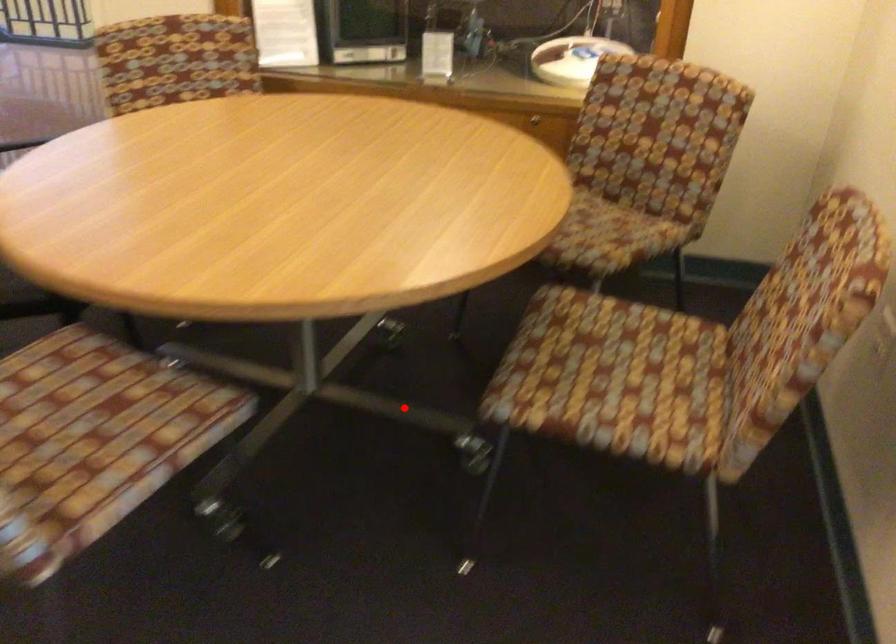
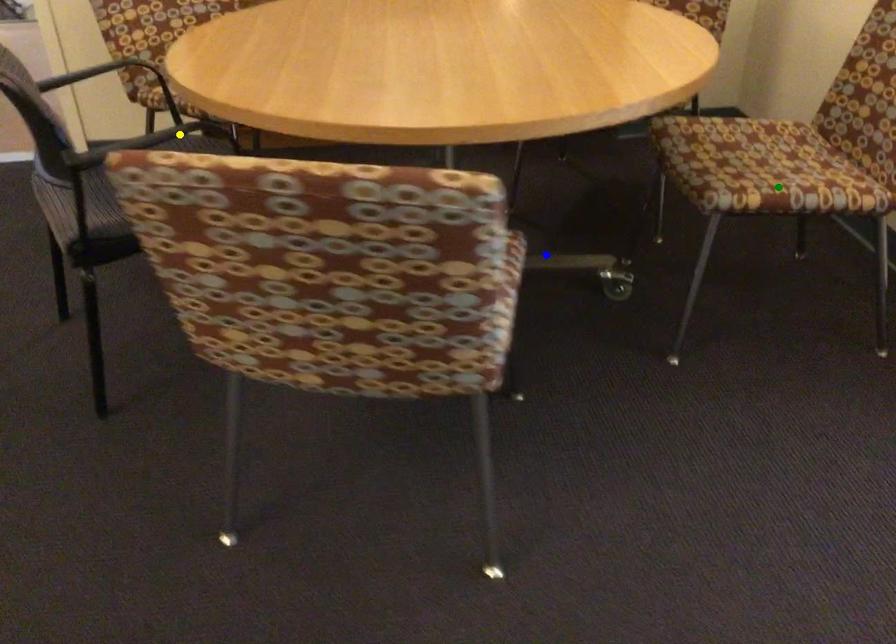
Question: I am providing you with two images of the same scene from different viewpoints. A red point is marked on the first image. You are given multiple points on the second image. In image 2, which mark is for the same physical point as the one in image 1?

Choices:
 (A) blue point
 (B) yellow point
 (C) green point

Answer: (A)